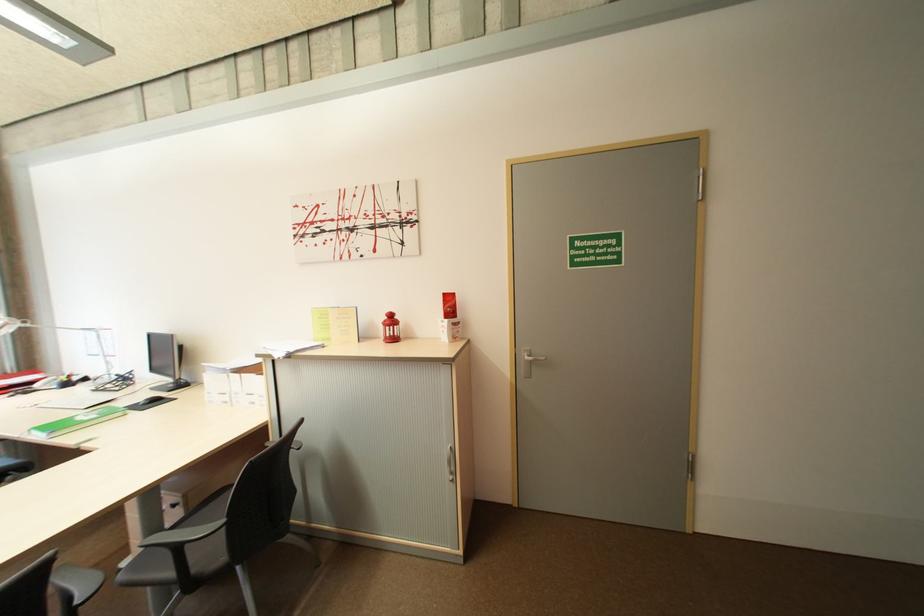
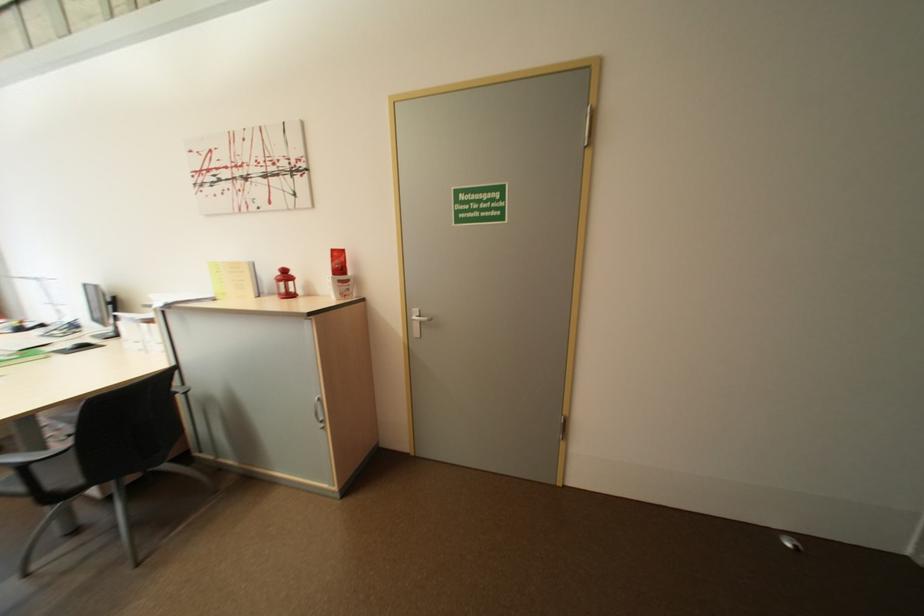
In the second image, find the point that corresponds to point 220,556 in the first image.

(75, 477)